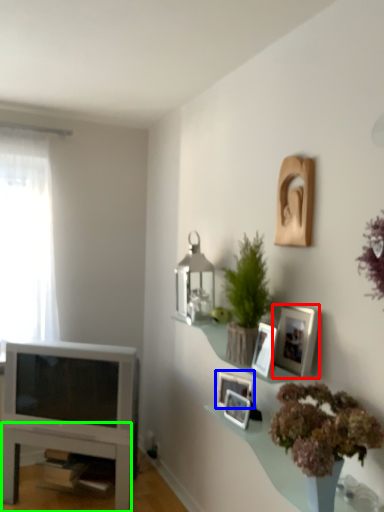
Question: Which object is positioned closest to picture frame (highlighted by a red box)? Select from picture frame (highlighted by a blue box) and table (highlighted by a green box).

Choices:
 (A) picture frame
 (B) table

Answer: (A)